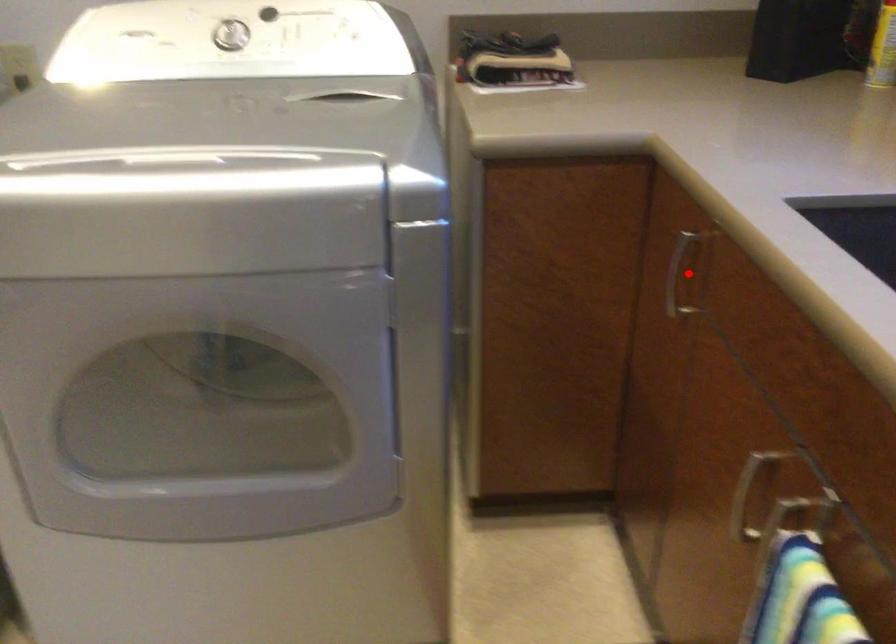
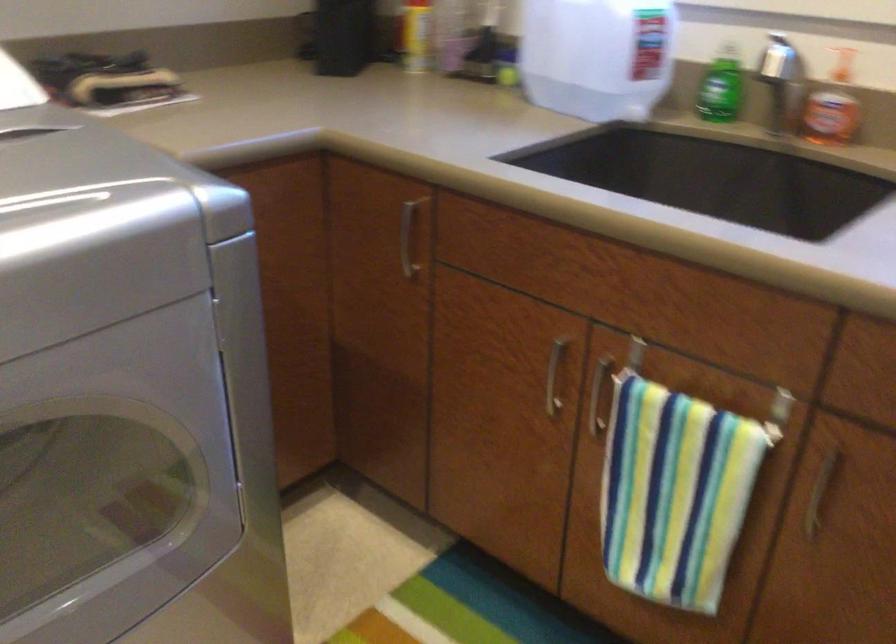
Question: I am providing you with two images of the same scene from different viewpoints. A red point is shown in image1. For the corresponding object point in image2, is it positioned nearer or farther from the camera?

Choices:
 (A) Nearer
 (B) Farther

Answer: (B)